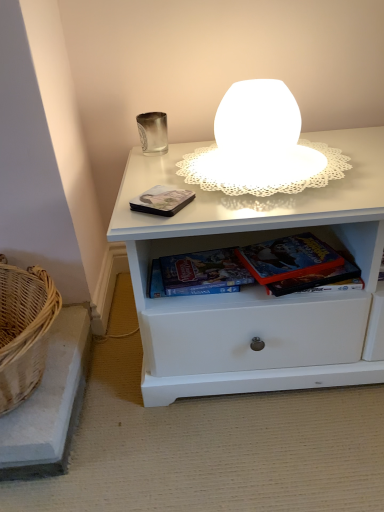
Based on the photo, measure the distance between point (236,136) and camera.

32.64 inches.

Measure the distance between metallic matte book at center, arranged as the first paperback book when viewed from the left, and camera.

metallic matte book at center, arranged as the first paperback book when viewed from the left, and camera are 29.98 inches apart.

How much space does metallic matte book at center, the third paperback book in the right-to-left sequence, occupy horizontally?

The width of metallic matte book at center, the third paperback book in the right-to-left sequence, is 3.97 inches.

How much space does hardcover book at center, which ranks as the second paperback book in right-to-left order, occupy horizontally?

3.70 inches.

What is the approximate width of woven wicker basket at lower left?

woven wicker basket at lower left is 16.61 inches wide.

Find the location of a particular element. The width and height of the screenshot is (384, 512). white frosted glass table lamp at upper center is located at coordinates (255, 144).

Is metallic matte book at center, the third paperback book in the right-to-left sequence, facing towards hardcover book at lower center, acting as the 1th paperback book starting from the right?

No.

Considering the relative positions of metallic matte book at center, arranged as the first paperback book when viewed from the left, and hardcover book at lower center, which ranks as the third paperback book in left-to-right order, in the image provided, is metallic matte book at center, arranged as the first paperback book when viewed from the left, to the left or to the right of hardcover book at lower center, which ranks as the third paperback book in left-to-right order,?

Based on their positions, metallic matte book at center, arranged as the first paperback book when viewed from the left, is located to the left of hardcover book at lower center, which ranks as the third paperback book in left-to-right order.

From the image's perspective, is metallic matte book at center, arranged as the first paperback book when viewed from the left, beneath hardcover book at lower center, acting as the 1th paperback book starting from the right?

Incorrect, from the image's perspective, metallic matte book at center, arranged as the first paperback book when viewed from the left, is higher than hardcover book at lower center, acting as the 1th paperback book starting from the right.

Which object is thinner, hardcover book at lower center, which ranks as the third paperback book in left-to-right order, or woven wicker basket at lower left?

hardcover book at lower center, which ranks as the third paperback book in left-to-right order, is thinner.

Considering the points (246, 251) and (62, 332), which point is in front, point (246, 251) or point (62, 332)?

Point (246, 251)

From the picture: Is hardcover book at lower center, which ranks as the third paperback book in left-to-right order, shorter than woven wicker basket at lower left?

Yes.

From a real-world perspective, count 2nd paperback books upward from the woven wicker basket at lower left and point to it. Please provide its 2D coordinates.

[(288, 258)]

Is the depth of woven wicker basket at lower left less than that of silver metallic cup at upper left?

Yes, it is.

Considering the positions of points (65, 453) and (149, 112), is point (65, 453) closer to camera compared to point (149, 112)?

That is True.

Would you consider woven wicker basket at lower left to be distant from silver metallic cup at upper left?

No, there isn't a large distance between woven wicker basket at lower left and silver metallic cup at upper left.

You are a GUI agent. You are given a task and a screenshot of the screen. Output one action in this format:
    pyautogui.click(x=<x>, y=<y>)
    Task: Click on the vanity that is below the silver metallic cup at upper left (from the image's perspective)
    The width and height of the screenshot is (384, 512).
    Given the screenshot: What is the action you would take?
    pyautogui.click(x=49, y=404)

Can we say white frosted glass table lamp at upper center lies outside woven wicker basket at lower left?

Yes.

Considering the sizes of objects white frosted glass table lamp at upper center and woven wicker basket at lower left in the image provided, who is taller, white frosted glass table lamp at upper center or woven wicker basket at lower left?

Standing taller between the two is woven wicker basket at lower left.

From the image's perspective, between white frosted glass table lamp at upper center and woven wicker basket at lower left, who is located below?

woven wicker basket at lower left appears lower in the image.

Is metallic matte book at center, arranged as the first paperback book when viewed from the left, wider or thinner than hardcover book at center, the second paperback book in the left-to-right sequence?

In the image, metallic matte book at center, arranged as the first paperback book when viewed from the left, appears to be wider than hardcover book at center, the second paperback book in the left-to-right sequence.

Is metallic matte book at center, arranged as the first paperback book when viewed from the left, taller or shorter than hardcover book at center, which ranks as the second paperback book in right-to-left order?

Considering their sizes, metallic matte book at center, arranged as the first paperback book when viewed from the left, has less height than hardcover book at center, which ranks as the second paperback book in right-to-left order.

Are metallic matte book at center, arranged as the first paperback book when viewed from the left, and hardcover book at center, the second paperback book in the left-to-right sequence, far apart?

Actually, metallic matte book at center, arranged as the first paperback book when viewed from the left, and hardcover book at center, the second paperback book in the left-to-right sequence, are a little close together.

From the picture: Could you tell me if metallic matte book at center, arranged as the first paperback book when viewed from the left, is turned towards hardcover book at center, which ranks as the second paperback book in right-to-left order?

No.

Is silver metallic cup at upper left facing away from hardcover book at center, which ranks as the second paperback book in right-to-left order?

No, silver metallic cup at upper left's orientation is not away from hardcover book at center, which ranks as the second paperback book in right-to-left order.

Considering the positions of objects silver metallic cup at upper left and hardcover book at center, the second paperback book in the left-to-right sequence, in the image provided, who is more to the right, silver metallic cup at upper left or hardcover book at center, the second paperback book in the left-to-right sequence,?

hardcover book at center, the second paperback book in the left-to-right sequence.

Which of these two, silver metallic cup at upper left or hardcover book at center, which ranks as the second paperback book in right-to-left order, is bigger?

With larger size is hardcover book at center, which ranks as the second paperback book in right-to-left order.

What's the angular difference between silver metallic cup at upper left and hardcover book at center, which ranks as the second paperback book in right-to-left order,'s facing directions?

silver metallic cup at upper left and hardcover book at center, which ranks as the second paperback book in right-to-left order, are facing 8.24 degrees away from each other.

Based on the photo, from the image's perspective, is woven wicker basket at lower left on top of hardcover book at lower center, which ranks as the third paperback book in left-to-right order?

No, from the image's perspective, woven wicker basket at lower left is not on top of hardcover book at lower center, which ranks as the third paperback book in left-to-right order.

Measure the distance from woven wicker basket at lower left to hardcover book at lower center, which ranks as the third paperback book in left-to-right order.

woven wicker basket at lower left and hardcover book at lower center, which ranks as the third paperback book in left-to-right order, are 19.77 inches apart from each other.

Which object is thinner, woven wicker basket at lower left or hardcover book at lower center, which ranks as the third paperback book in left-to-right order?

With smaller width is hardcover book at lower center, which ranks as the third paperback book in left-to-right order.

Are woven wicker basket at lower left and hardcover book at lower center, acting as the 1th paperback book starting from the right, making contact?

There is a gap between woven wicker basket at lower left and hardcover book at lower center, acting as the 1th paperback book starting from the right.

Find the location of a particular element. paperback book above the hardcover book at lower center, acting as the 1th paperback book starting from the right (from the image's perspective) is located at coordinates (162, 200).

Where is `vanity that appears below the hardcover book at lower center, acting as the 1th paperback book starting from the right (from the image's perspective)`? The image size is (384, 512). vanity that appears below the hardcover book at lower center, acting as the 1th paperback book starting from the right (from the image's perspective) is located at coordinates (49, 404).

From the image, which object appears to be nearer to hardcover book at lower center, which ranks as the third paperback book in left-to-right order, hardcover book at center, the second paperback book in the left-to-right sequence, or woven wicker basket at lower left?

hardcover book at center, the second paperback book in the left-to-right sequence.

From the image, which object appears to be nearer to silver metallic cup at upper left, hardcover book at lower center, acting as the 1th paperback book starting from the right, or white frosted glass table lamp at upper center?

white frosted glass table lamp at upper center.

Based on the photo, considering their positions, is silver metallic cup at upper left positioned further to woven wicker basket at lower left than hardcover book at center, the second paperback book in the left-to-right sequence?

silver metallic cup at upper left lies further to woven wicker basket at lower left than the other object.

Looking at this image, based on their spatial positions, is white frosted glass table lamp at upper center or silver metallic cup at upper left further from hardcover book at center, the second paperback book in the left-to-right sequence?

silver metallic cup at upper left is further to hardcover book at center, the second paperback book in the left-to-right sequence.

Which object lies further to the anchor point white frosted glass table lamp at upper center, woven wicker basket at lower left or metallic matte book at center, arranged as the first paperback book when viewed from the left?

woven wicker basket at lower left lies further to white frosted glass table lamp at upper center than the other object.

From the image, which object appears to be nearer to woven wicker basket at lower left, hardcover book at center, the second paperback book in the left-to-right sequence, or hardcover book at lower center, acting as the 1th paperback book starting from the right?

Among the two, hardcover book at center, the second paperback book in the left-to-right sequence, is located nearer to woven wicker basket at lower left.

In the scene shown: Based on their spatial positions, is white frosted glass table lamp at upper center or woven wicker basket at lower left further from hardcover book at center, which ranks as the second paperback book in right-to-left order?

Among the two, woven wicker basket at lower left is located further to hardcover book at center, which ranks as the second paperback book in right-to-left order.

In the scene shown: Based on their spatial positions, is metallic matte book at center, arranged as the first paperback book when viewed from the left, or hardcover book at center, the second paperback book in the left-to-right sequence, further from hardcover book at lower center, acting as the 1th paperback book starting from the right?

metallic matte book at center, arranged as the first paperback book when viewed from the left, is further to hardcover book at lower center, acting as the 1th paperback book starting from the right.

Locate an element on the screen. This screenshot has width=384, height=512. paperback book between metallic matte book at center, arranged as the first paperback book when viewed from the left, and hardcover book at lower center, which ranks as the third paperback book in left-to-right order is located at coordinates (198, 274).

You are a GUI agent. You are given a task and a screenshot of the screen. Output one action in this format:
    pyautogui.click(x=<x>, y=<y>)
    Task: Click on the table lamp between silver metallic cup at upper left and woven wicker basket at lower left in the vertical direction
    
    Given the screenshot: What is the action you would take?
    pyautogui.click(x=255, y=144)

The height and width of the screenshot is (512, 384). Find the location of `table lamp between silver metallic cup at upper left and hardcover book at lower center, acting as the 1th paperback book starting from the right, vertically`. table lamp between silver metallic cup at upper left and hardcover book at lower center, acting as the 1th paperback book starting from the right, vertically is located at coordinates (255, 144).

In order to click on table lamp between metallic matte book at center, the third paperback book in the right-to-left sequence, and hardcover book at lower center, which ranks as the third paperback book in left-to-right order in this screenshot , I will do `click(255, 144)`.